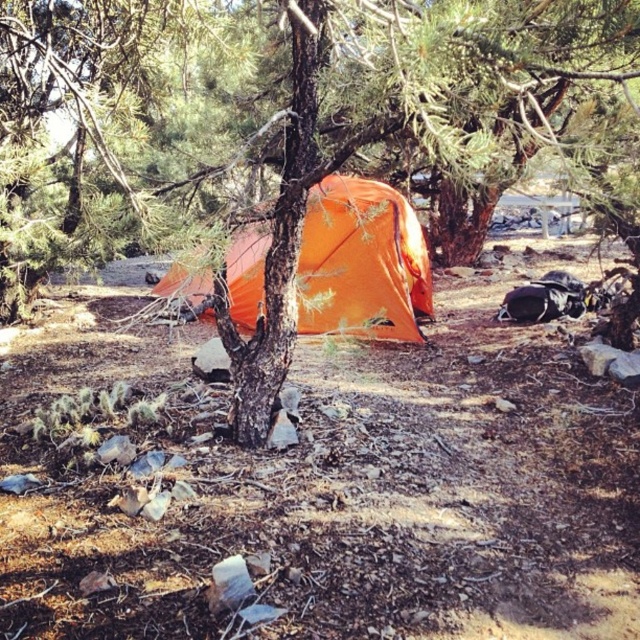
Question: Can you confirm if smooth bark tree at center is positioned above orange fabric tent at center?

Choices:
 (A) yes
 (B) no

Answer: (A)

Question: Among these objects, which one is farthest from the camera?

Choices:
 (A) smooth bark tree at center
 (B) orange fabric tent at center

Answer: (A)

Question: From the image, what is the correct spatial relationship of smooth bark tree at center in relation to orange fabric tent at center?

Choices:
 (A) above
 (B) below

Answer: (A)

Question: Considering the relative positions of smooth bark tree at center and orange fabric tent at center in the image provided, where is smooth bark tree at center located with respect to orange fabric tent at center?

Choices:
 (A) above
 (B) below

Answer: (A)